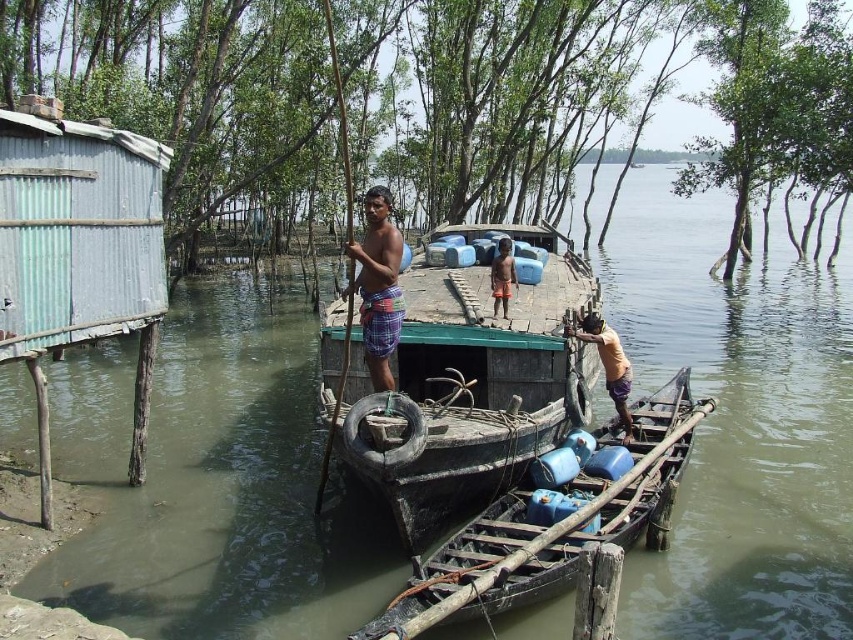
Question: Which point is closer to the camera taking this photo?

Choices:
 (A) click(x=512, y=284)
 (B) click(x=183, y=317)

Answer: (A)

Question: Where is wooden boat at center located in relation to orange plaid shorts at center in the image?

Choices:
 (A) above
 (B) below

Answer: (A)

Question: Does green wooden boat at center come behind orange plaid shorts at center?

Choices:
 (A) no
 (B) yes

Answer: (A)

Question: Which of these objects is positioned closest to the orange plaid shorts at center?

Choices:
 (A) brown woven basket at center
 (B) green wooden boat at center

Answer: (A)

Question: Which object is closer to the camera taking this photo?

Choices:
 (A) green wooden boat at center
 (B) wooden boat at center
 (C) brown woven basket at center
 (D) plaid fabric shorts at center

Answer: (A)

Question: Is rusty wood boat at center below orange plaid shorts at center?

Choices:
 (A) no
 (B) yes

Answer: (B)